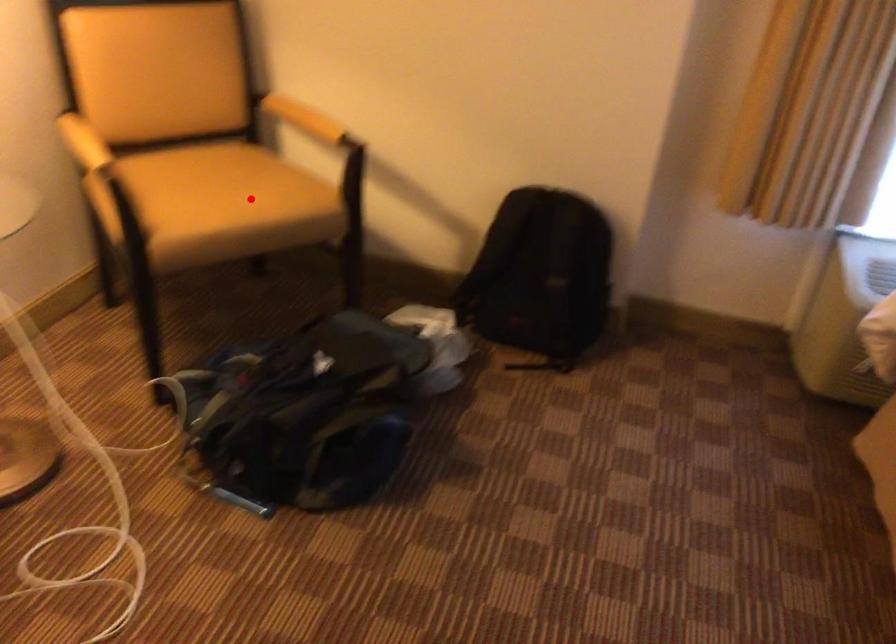
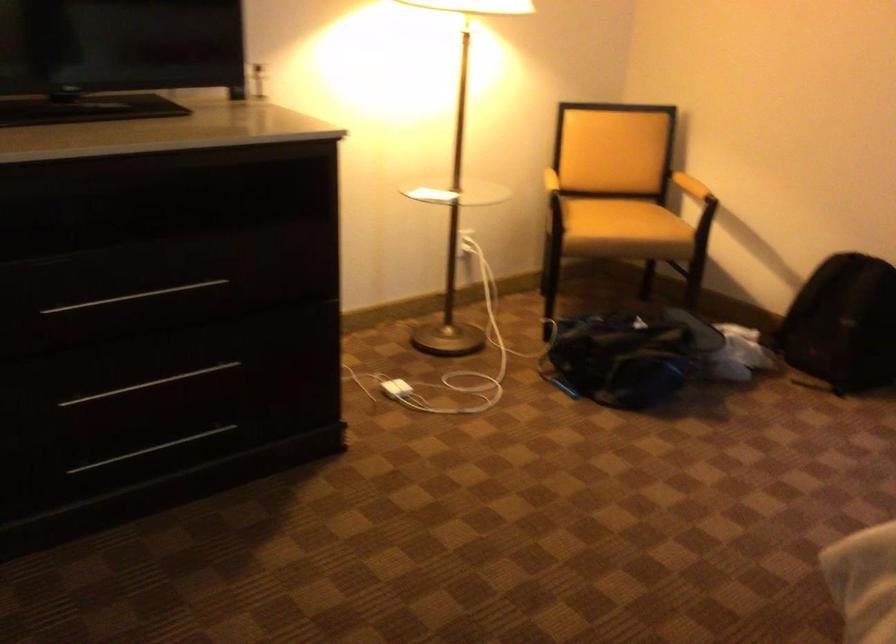
Question: I am providing you with two images of the same scene from different viewpoints. Given a red point in image1, look at the same physical point in image2. Is it:

Choices:
 (A) Closer to the viewpoint
 (B) Farther from the viewpoint

Answer: (B)